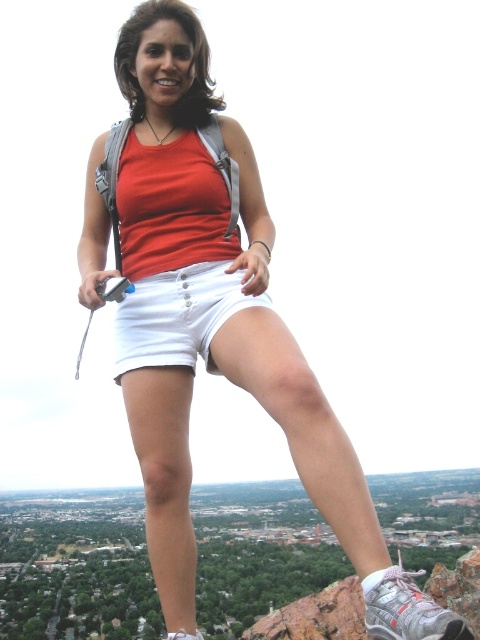
Looking at this image, between white cotton shorts at center and rocky cliff at upper center, which one is positioned lower?

rocky cliff at upper center is below.

Is white cotton shorts at center positioned at the back of rocky cliff at upper center?

That is True.

Is point (135, 291) in front of point (356, 598)?

That is False.

At what (x,y) coordinates should I click in order to perform the action: click on white cotton shorts at center. Please return your answer as a coordinate pair (x, y). This screenshot has height=640, width=480. Looking at the image, I should click on (177, 316).

Which of these two, white cotton shorts at center or matte red tank top at center, stands shorter?

→ white cotton shorts at center is shorter.

Which of these two, white cotton shorts at center or matte red tank top at center, stands taller?

matte red tank top at center

Identify the location of white cotton shorts at center. This screenshot has height=640, width=480. (177, 316).

At what (x,y) coordinates should I click in order to perform the action: click on white cotton shorts at center. Please return your answer as a coordinate pair (x, y). This screenshot has width=480, height=640. Looking at the image, I should click on (177, 316).

Does point (276, 624) lie behind point (98, 189)?

Yes.

This screenshot has width=480, height=640. In order to click on rocky cliff at upper center in this screenshot , I will do `click(316, 616)`.